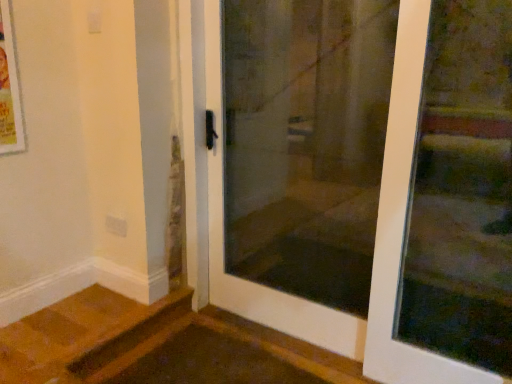
Measure the distance between transparent glass screen door at center and camera.

transparent glass screen door at center and camera are 1.66 meters apart from each other.

In order to click on transparent glass door at upper right, which is the second door from left to right in this screenshot , I will do `click(446, 200)`.

Can white glass door at center, which ranks as the first door in left-to-right order, be found inside transparent glass door at upper right, which is the second door from left to right?

No, white glass door at center, which ranks as the first door in left-to-right order, is not inside transparent glass door at upper right, which is the second door from left to right.

Is point (430, 78) more distant than point (361, 43)?

That is False.

From the image's perspective, does transparent glass door at upper right, placed as the first door when sorted from right to left, appear lower than white glass door at center, which is the second door in right-to-left order?

Yes.

Is transparent glass door at upper right, which is the second door from left to right, not close to white glass door at center, which is the second door in right-to-left order?

Actually, transparent glass door at upper right, which is the second door from left to right, and white glass door at center, which is the second door in right-to-left order, are a little close together.

From a real-world perspective, who is located lower, white glass door at center, which is the second door in right-to-left order, or transparent glass door at upper right, which is the second door from left to right?

transparent glass door at upper right, which is the second door from left to right.

Considering the relative sizes of white glass door at center, which is the second door in right-to-left order, and transparent glass door at upper right, which is the second door from left to right, in the image provided, is white glass door at center, which is the second door in right-to-left order, shorter than transparent glass door at upper right, which is the second door from left to right,?

Incorrect, the height of white glass door at center, which is the second door in right-to-left order, does not fall short of that of transparent glass door at upper right, which is the second door from left to right.

In the scene shown: Can you confirm if white glass door at center, which is the second door in right-to-left order, is thinner than transparent glass door at upper right, which is the second door from left to right?

No.

Is point (496, 373) behind point (380, 61)?

That is False.

In terms of height, does transparent glass door at upper right, which is the second door from left to right, look taller or shorter compared to transparent glass screen door at center?

transparent glass door at upper right, which is the second door from left to right, is shorter than transparent glass screen door at center.

Is transparent glass door at upper right, placed as the first door when sorted from right to left, turned away from transparent glass screen door at center?

No.

Does transparent glass door at upper right, which is the second door from left to right, lie behind transparent glass screen door at center?

No, transparent glass door at upper right, which is the second door from left to right, is closer to the viewer.

Between point (334, 140) and point (449, 166), which one is positioned in front?

Positioned in front is point (449, 166).

Is transparent glass screen door at center positioned behind transparent glass door at upper right, which is the second door from left to right?

Yes, it is.

Can you tell me how much transparent glass screen door at center and transparent glass door at upper right, which is the second door from left to right, differ in facing direction?

There is a 0.0209-degree angle between the facing directions of transparent glass screen door at center and transparent glass door at upper right, which is the second door from left to right.

From a real-world perspective, which object stands above the other?

transparent glass screen door at center, from a real-world perspective.

Which of these two, transparent glass screen door at center or white glass door at center, which ranks as the first door in left-to-right order, stands taller?

With more height is transparent glass screen door at center.

Does transparent glass screen door at center have a smaller size compared to white glass door at center, which ranks as the first door in left-to-right order?

Yes, transparent glass screen door at center is smaller than white glass door at center, which ranks as the first door in left-to-right order.

Who is more distant, transparent glass screen door at center or white glass door at center, which ranks as the first door in left-to-right order?

transparent glass screen door at center is behind.

Can you confirm if transparent glass screen door at center is positioned to the left of white glass door at center, which ranks as the first door in left-to-right order?

Yes, transparent glass screen door at center is to the left of white glass door at center, which ranks as the first door in left-to-right order.

Is white glass door at center, which is the second door in right-to-left order, placed right next to transparent glass screen door at center?

Yes, white glass door at center, which is the second door in right-to-left order, and transparent glass screen door at center clearly make contact.

How many degrees apart are the facing directions of white glass door at center, which is the second door in right-to-left order, and transparent glass screen door at center?

0.0164 degrees.

From a real-world perspective, is white glass door at center, which ranks as the first door in left-to-right order, above or below transparent glass screen door at center?

Clearly, from a real-world perspective, white glass door at center, which ranks as the first door in left-to-right order, is above transparent glass screen door at center.

Could transparent glass screen door at center be considered to be inside white glass door at center, which is the second door in right-to-left order?

Definitely not — transparent glass screen door at center is not inside white glass door at center, which is the second door in right-to-left order.

Locate an element on the screen. door that appears behind the white glass door at center, which ranks as the first door in left-to-right order is located at coordinates click(446, 200).

Image resolution: width=512 pixels, height=384 pixels. Find the location of `door positioned vertically above the transparent glass door at upper right, which is the second door from left to right (from a real-world perspective)`. door positioned vertically above the transparent glass door at upper right, which is the second door from left to right (from a real-world perspective) is located at coordinates (369, 177).

From the image, which object appears to be farther from white glass door at center, which ranks as the first door in left-to-right order, transparent glass screen door at center or transparent glass door at upper right, placed as the first door when sorted from right to left?

transparent glass door at upper right, placed as the first door when sorted from right to left, lies further to white glass door at center, which ranks as the first door in left-to-right order, than the other object.

When comparing their distances from transparent glass door at upper right, placed as the first door when sorted from right to left, does white glass door at center, which is the second door in right-to-left order, or transparent glass screen door at center seem further?

transparent glass screen door at center is positioned further to the anchor transparent glass door at upper right, placed as the first door when sorted from right to left.

Considering their positions, is transparent glass door at upper right, placed as the first door when sorted from right to left, positioned further to white glass door at center, which ranks as the first door in left-to-right order, than transparent glass screen door at center?

Based on the image, transparent glass door at upper right, placed as the first door when sorted from right to left, appears to be further to white glass door at center, which ranks as the first door in left-to-right order.

Which object lies nearer to the anchor point transparent glass door at upper right, placed as the first door when sorted from right to left, transparent glass screen door at center or white glass door at center, which is the second door in right-to-left order?

Among the two, white glass door at center, which is the second door in right-to-left order, is located nearer to transparent glass door at upper right, placed as the first door when sorted from right to left.

From the image, which object appears to be farther from transparent glass screen door at center, transparent glass door at upper right, placed as the first door when sorted from right to left, or white glass door at center, which is the second door in right-to-left order?

transparent glass door at upper right, placed as the first door when sorted from right to left, is positioned further to the anchor transparent glass screen door at center.

From the image, which object appears to be farther from transparent glass screen door at center, white glass door at center, which ranks as the first door in left-to-right order, or transparent glass door at upper right, placed as the first door when sorted from right to left?

The object further to transparent glass screen door at center is transparent glass door at upper right, placed as the first door when sorted from right to left.

Locate an element on the screen. door between transparent glass screen door at center and transparent glass door at upper right, placed as the first door when sorted from right to left, from left to right is located at coordinates (369, 177).